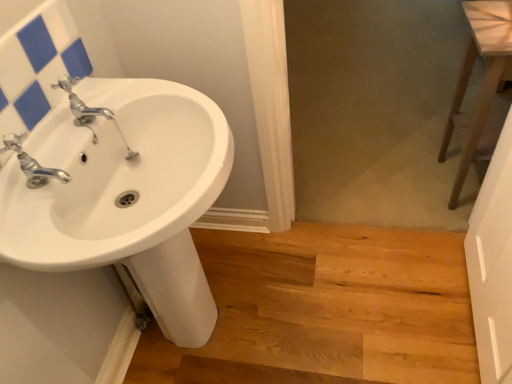
Identify the location of empty space that is ontop of light brown wood at lower center (from a real-world perspective). (315, 304).